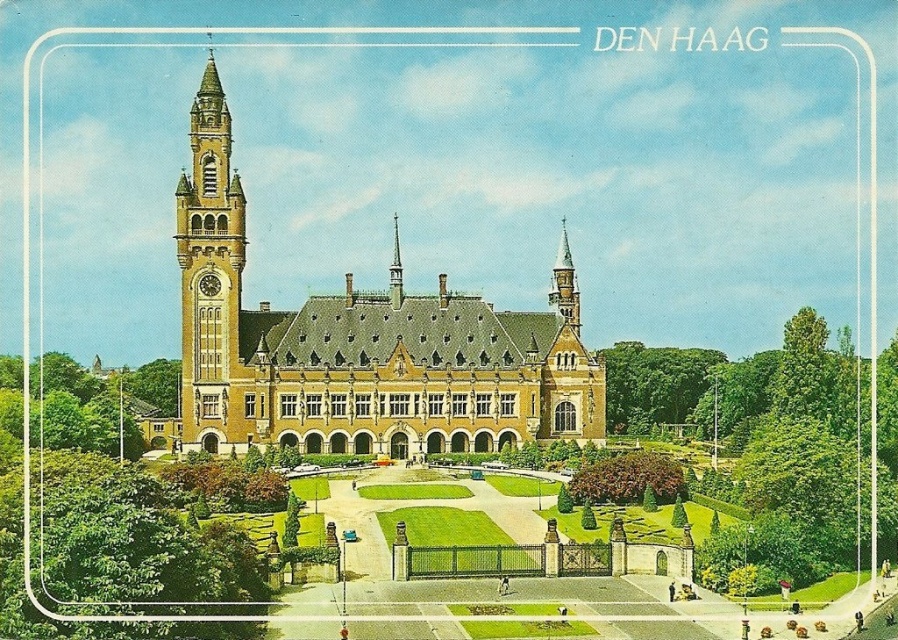
Can you confirm if polished copper spire at upper right is positioned to the right of shiny silver spire at center?

Yes, polished copper spire at upper right is to the right of shiny silver spire at center.

Is polished copper spire at upper right closer to camera compared to shiny silver spire at center?

No, it is behind shiny silver spire at center.

Is point (578, 321) farther from camera compared to point (395, 301)?

That is True.

At what (x,y) coordinates should I click in order to perform the action: click on polished copper spire at upper right. Please return your answer as a coordinate pair (x, y). Looking at the image, I should click on (564, 284).

Can you confirm if yellow brick church at left is shorter than shiny silver spire at center?

No, yellow brick church at left is not shorter than shiny silver spire at center.

Who is more forward, (212, 188) or (395, 243)?

Point (212, 188)

Is point (318, 365) positioned behind point (393, 298)?

No, (318, 365) is in front of (393, 298).

At what (x,y) coordinates should I click in order to perform the action: click on yellow brick church at left. Please return your answer as a coordinate pair (x, y). This screenshot has height=640, width=898. Looking at the image, I should click on (355, 346).

Does golden stone clock tower at left have a greater width compared to polished copper spire at upper right?

Yes, golden stone clock tower at left is wider than polished copper spire at upper right.

Who is more distant from viewer, (213, 84) or (551, 282)?

Positioned behind is point (551, 282).

Find the location of `golden stone clock tower at left`. golden stone clock tower at left is located at coordinates (210, 276).